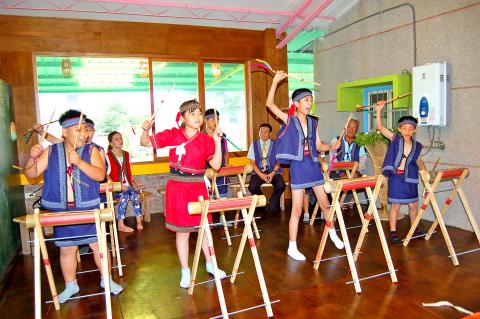
Where is `window`? window is located at coordinates (49, 100), (114, 105), (175, 97), (231, 108).